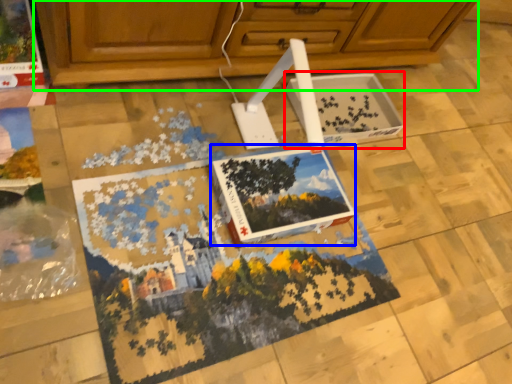
Question: Considering the real-world distances, which object is closest to cardboard box (highlighted by a red box)? magazine (highlighted by a blue box) or cabinetry (highlighted by a green box).

Choices:
 (A) magazine
 (B) cabinetry

Answer: (B)